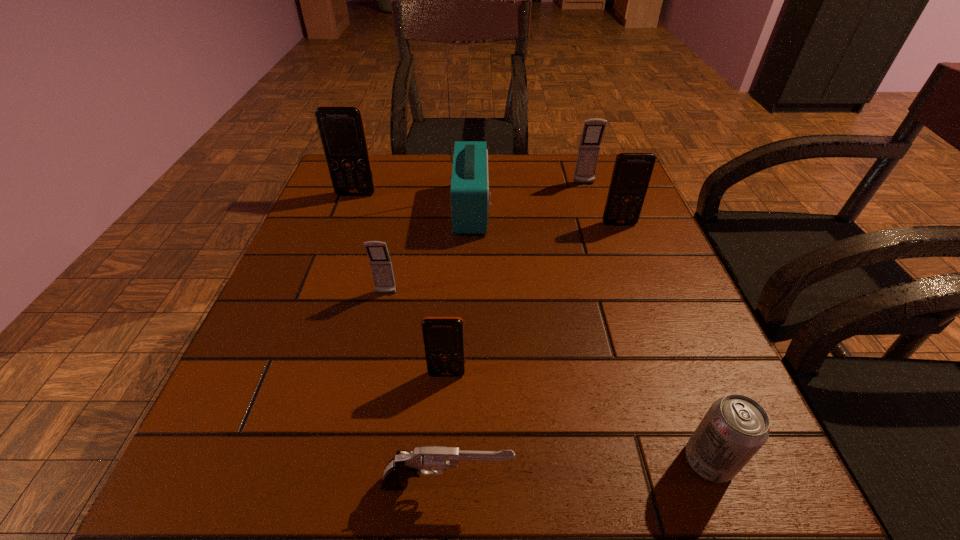
This screenshot has height=540, width=960. In order to click on vacant space that's between the right gray cellular telephone and the soda can in this screenshot , I will do `click(646, 322)`.

What are the coordinates of `vacant space that is in between the gray soda can and the second smallest orange cellular telephone` in the screenshot? It's located at (664, 342).

At what (x,y) coordinates should I click in order to perform the action: click on vacant point located between the soda can and the right gray cellular telephone. Please return your answer as a coordinate pair (x, y). Looking at the image, I should click on (646, 322).

I want to click on vacant space that is in between the bigger gray cellular telephone and the fourth farthest cellular telephone, so click(485, 239).

Choose which object is the third nearest neighbor to the tallest object. Please provide its 2D coordinates. Your answer should be formatted as a tuple, i.e. [(x, y)], where the tuple contains the x and y coordinates of a point satisfying the conditions above.

[(593, 130)]

Select which object appears as the fourth closest to the shortest object. Please provide its 2D coordinates. Your answer should be formatted as a tuple, i.e. [(x, y)], where the tuple contains the x and y coordinates of a point satisfying the conditions above.

[(470, 203)]

Locate which cellular telephone ranks third in proximity to the sixth farthest object. Please provide its 2D coordinates. Your answer should be formatted as a tuple, i.e. [(x, y)], where the tuple contains the x and y coordinates of a point satisfying the conditions above.

[(341, 128)]

You are a GUI agent. You are given a task and a screenshot of the screen. Output one action in this format:
    pyautogui.click(x=<x>, y=<y>)
    Task: Click on the fourth closest cellular telephone to the gray soda can
    The width and height of the screenshot is (960, 540).
    Given the screenshot: What is the action you would take?
    pyautogui.click(x=593, y=130)

This screenshot has width=960, height=540. I want to click on orange cellular telephone that can be found as the closest to the biggest orange cellular telephone, so click(x=443, y=337).

Find the location of a particular element. The height and width of the screenshot is (540, 960). orange cellular telephone that is the second closest to the second object from left to right is located at coordinates (341, 128).